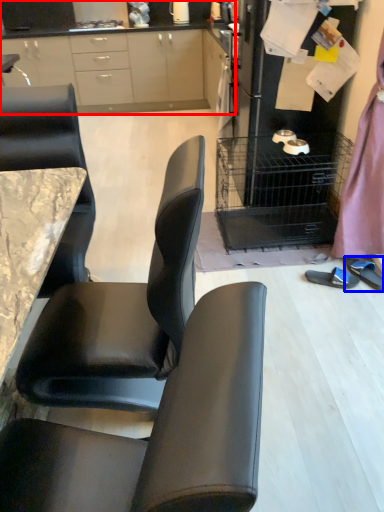
Question: Which point is further to the camera, cabinetry (highlighted by a red box) or footwear (highlighted by a blue box)?

Choices:
 (A) cabinetry
 (B) footwear

Answer: (A)